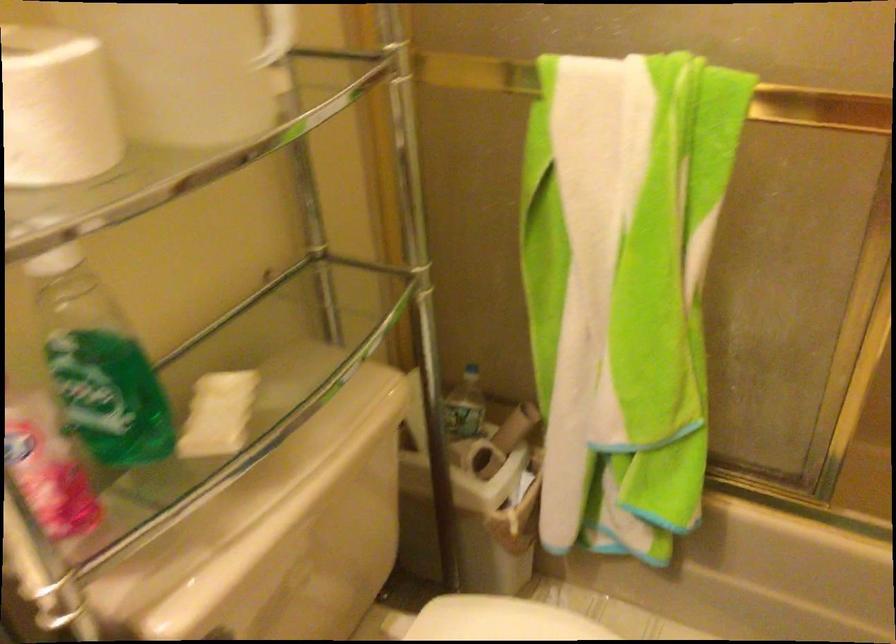
Find where to lift the clear water bottle. Please return your answer as a coordinate pair (x, y).

(270, 64)